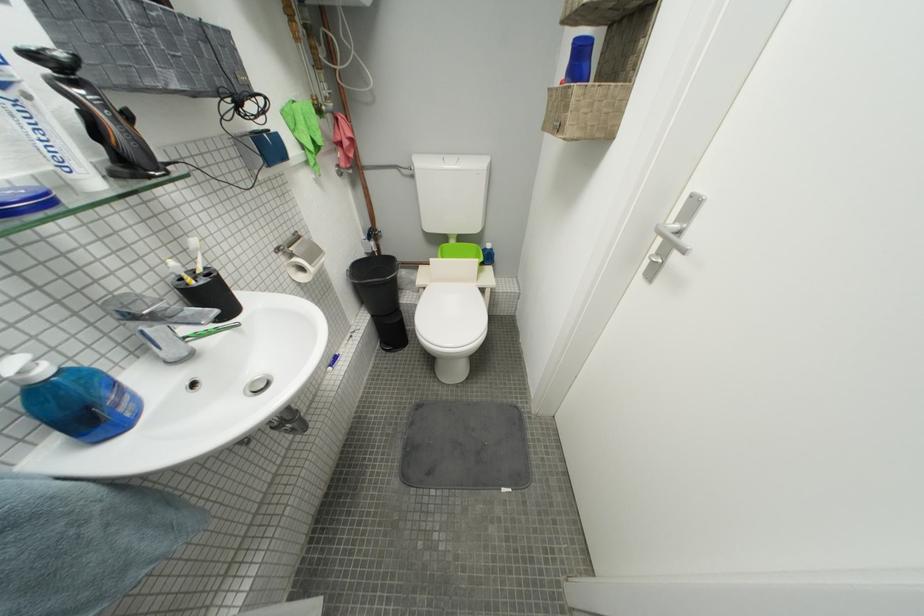
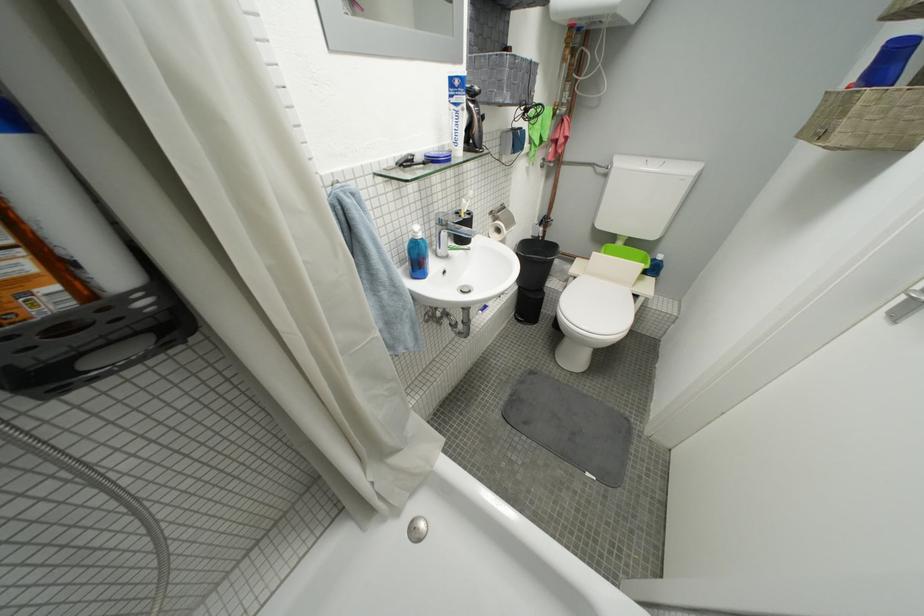
Where in the second image is the point corresponding to (x=459, y=166) from the first image?

(662, 169)